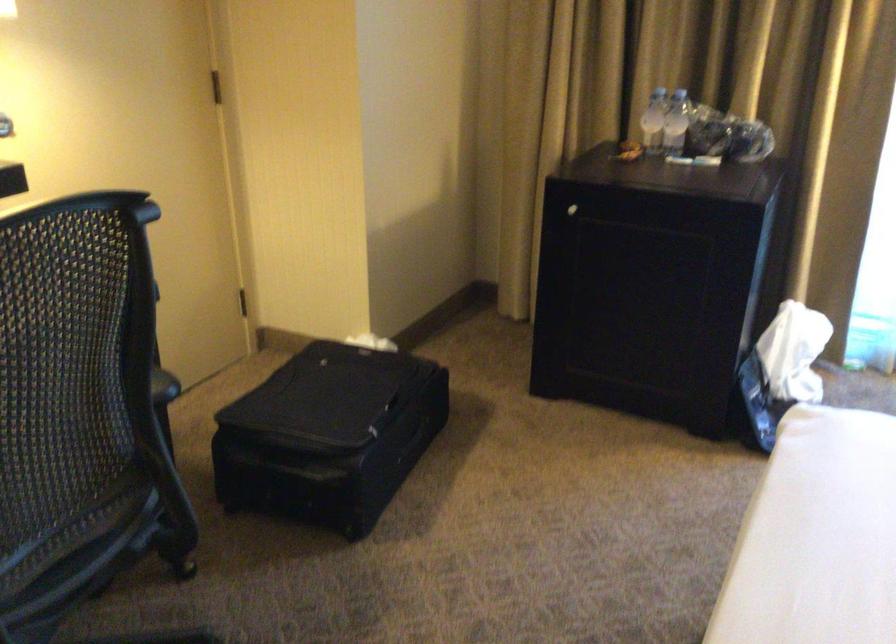
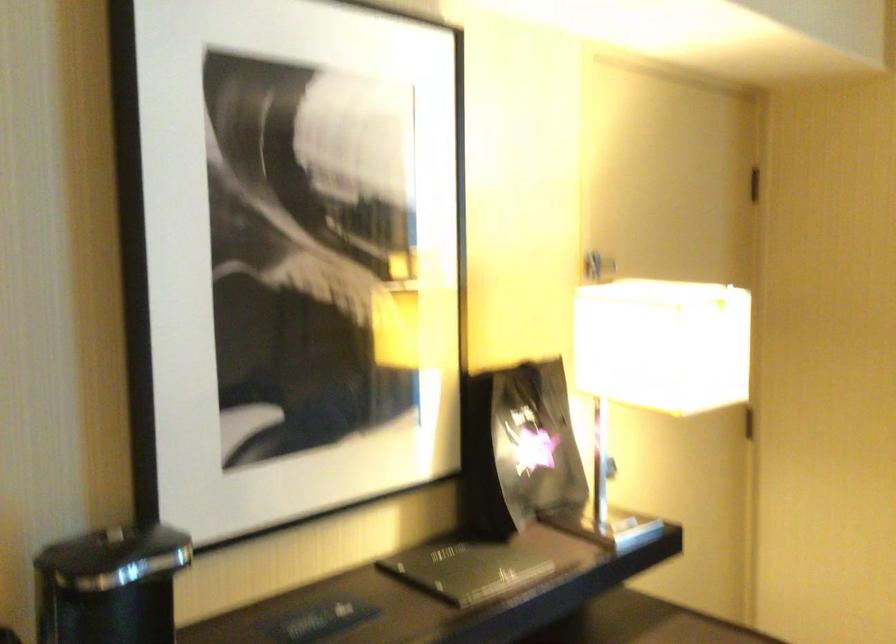
How did the camera likely rotate?

The camera rotated toward left-up.